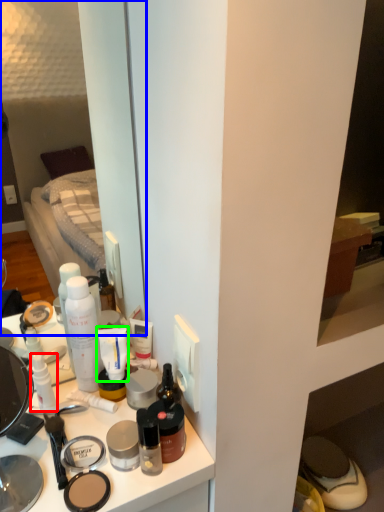
Question: Which object is positioned farthest from toiletry (highlighted by a red box)? Select from mirror (highlighted by a blue box) and toothpaste (highlighted by a green box).

Choices:
 (A) mirror
 (B) toothpaste

Answer: (A)